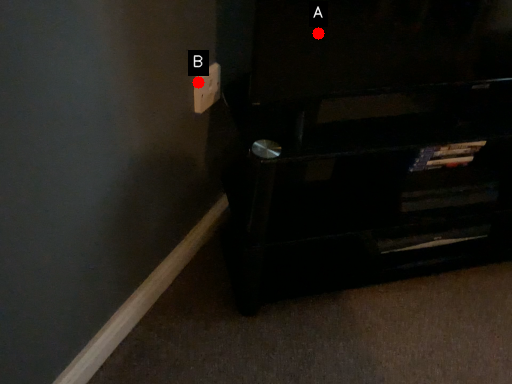
Question: Two points are circled on the image, labeled by A and B beside each circle. Which point is closer to the camera taking this photo?

Choices:
 (A) A is closer
 (B) B is closer

Answer: (A)